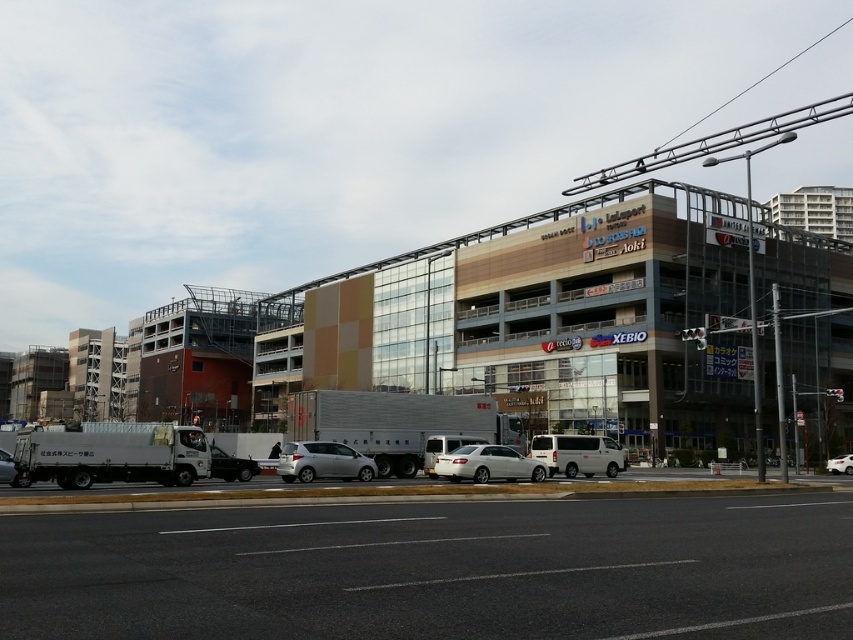
You are a pedestrian standing on the sidewalk in front of the commercial building. You need to cross the street to reach the entrance. Is there a clear path between the satin black sedan at center and the silver metallic truck at lower left?

The satin black sedan at center is positioned under the silver metallic truck at lower left, which means the sedan is directly beneath the truck. This suggests that the truck is parked above the sedan, possibly on a different level of the parking structure. Therefore, there is a clear path between them as they are not blocking each other on the same level.

You are a pedestrian standing on the sidewalk in front of the building. You want to cross the street to reach the entrance of the building. Which vehicle, the silver metallic truck at center or the white matte van at center, is closer to you as you stand on the sidewalk?

The silver metallic truck at center is closer to you because it is positioned nearer to the viewer compared to the white matte van at center.